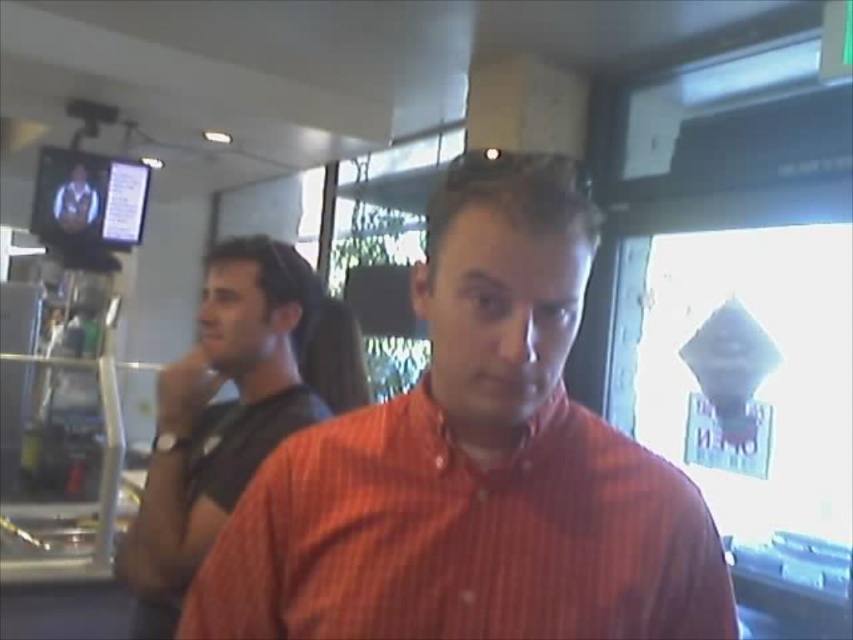
Can you confirm if black matte shirt at left is wider than matte black shirt at upper left?

Yes, black matte shirt at left is wider than matte black shirt at upper left.

Looking at this image, is black matte shirt at left to the right of matte black shirt at upper left from the viewer's perspective?

Correct, you'll find black matte shirt at left to the right of matte black shirt at upper left.

Between point (141, 616) and point (78, 182), which one is positioned in front?

Point (141, 616) is in front.

This screenshot has height=640, width=853. Find the location of `black matte shirt at left`. black matte shirt at left is located at coordinates (219, 417).

Measure the distance from orange striped shirt at center to black matte shirt at left.

24.81 inches

Can you confirm if orange striped shirt at center is taller than black matte shirt at left?

Incorrect, orange striped shirt at center's height is not larger of black matte shirt at left's.

You are a GUI agent. You are given a task and a screenshot of the screen. Output one action in this format:
    pyautogui.click(x=<x>, y=<y>)
    Task: Click on the orange striped shirt at center
    
    Given the screenshot: What is the action you would take?
    pyautogui.click(x=463, y=536)

Between orange striped shirt at center and matte black shirt at upper left, which one has more height?

matte black shirt at upper left is taller.

Is orange striped shirt at center positioned at the back of matte black shirt at upper left?

No, it is not.

What are the coordinates of `orange striped shirt at center` in the screenshot? It's located at (463, 536).

Find the location of a particular element. This screenshot has height=640, width=853. orange striped shirt at center is located at coordinates (463, 536).